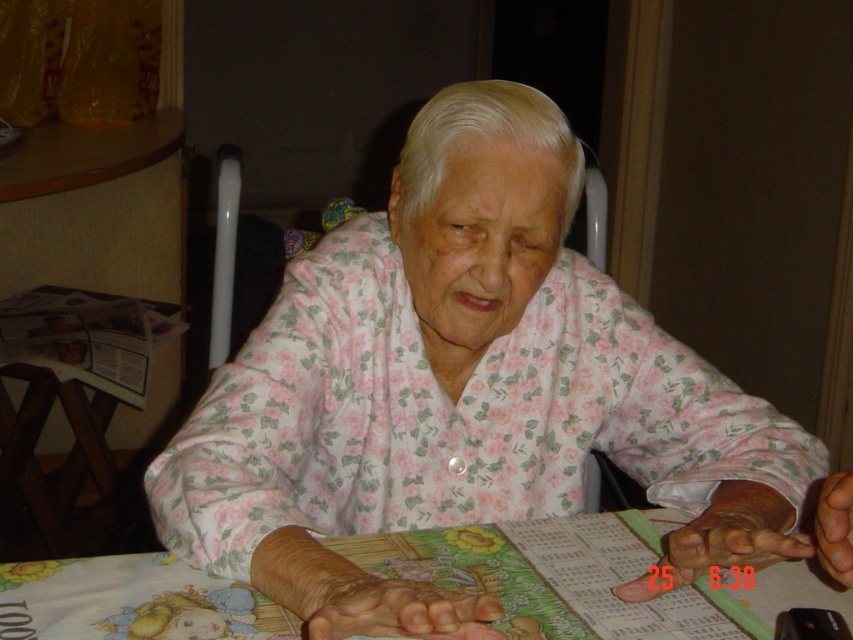
You are a photographer trying to capture a closeup of the floral fabric at center and the brown leather hand at lower right. Which object should you focus on first to ensure it appears sharp in the photo?

The floral fabric at center should be focused on first because it is closer to the viewer than the brown leather hand at lower right, ensuring it will be sharp. However, since the hand is further away, adjusting the focus might be needed for both to be clear.

You are a physical therapist observing an elderly patient participating in an activity. The patient has a printed sheet on the table with a floral fabric at center and a smooth skin hand at center. Based on the positioning of these items, can the patient easily access the printed sheet without moving their hands?

The floral fabric at center is much taller than the smooth skin hand at center, so the patient may need to adjust their hand position to access the printed sheet since the floral fabric is elevated above the hand level.